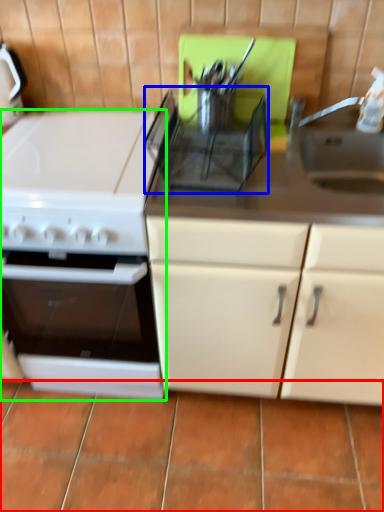
Question: Considering the real-world distances, which object is closest to tile (highlighted by a red box)? appliance (highlighted by a blue box) or kitchen appliance (highlighted by a green box).

Choices:
 (A) appliance
 (B) kitchen appliance

Answer: (B)